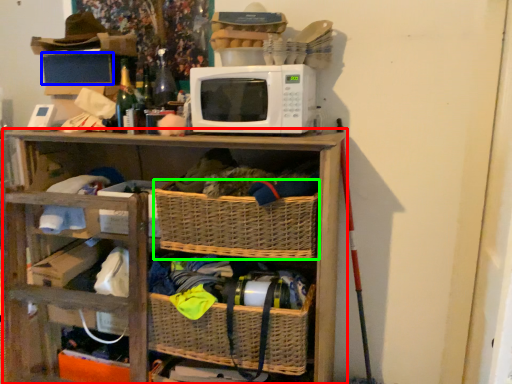
Question: Estimate the real-world distances between objects in this image. Which object is farther from shelf (highlighted by a red box), storage box (highlighted by a blue box) or basket (highlighted by a green box)?

Choices:
 (A) storage box
 (B) basket

Answer: (A)